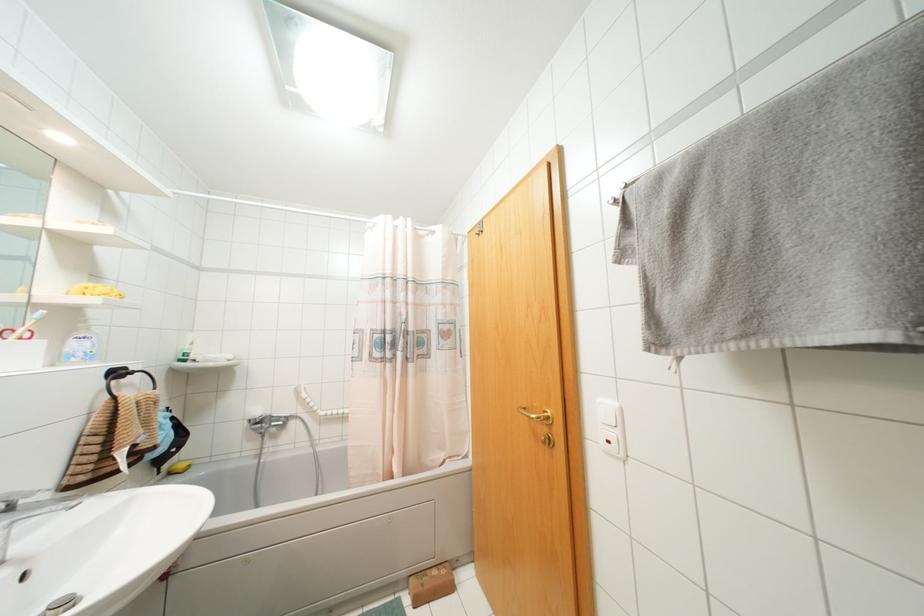
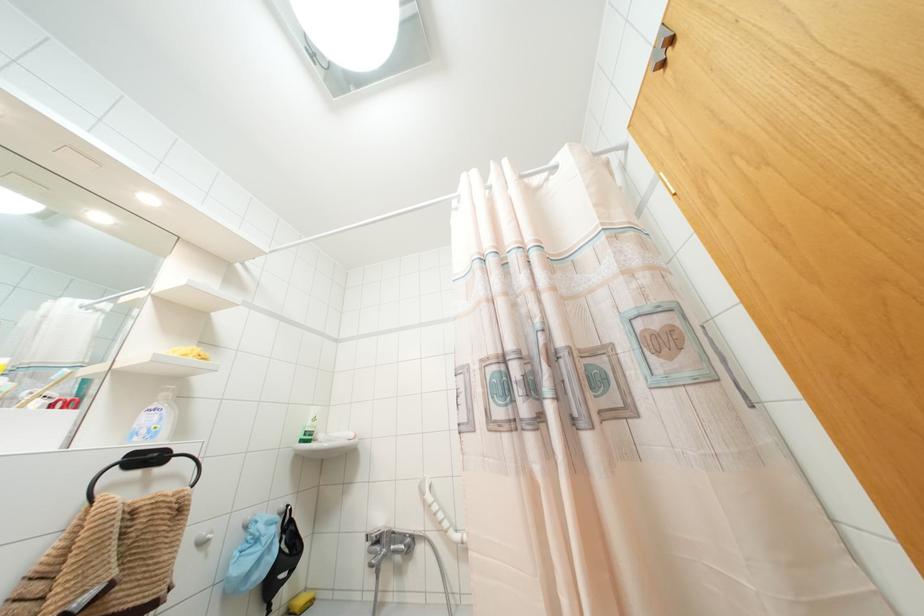
The point at [88,344] is marked in the first image. Where is the corresponding point in the second image?

(154, 418)